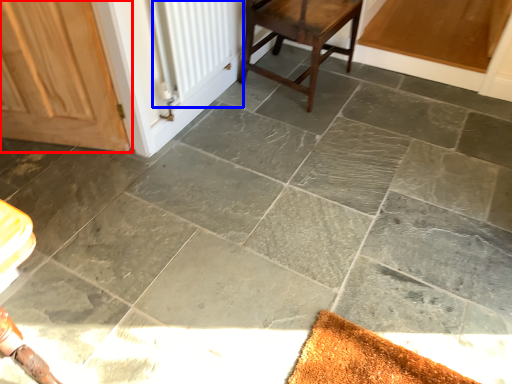
Question: Which of the following is the closest to the observer, door (highlighted by a red box) or radiator (highlighted by a blue box)?

Choices:
 (A) door
 (B) radiator

Answer: (A)